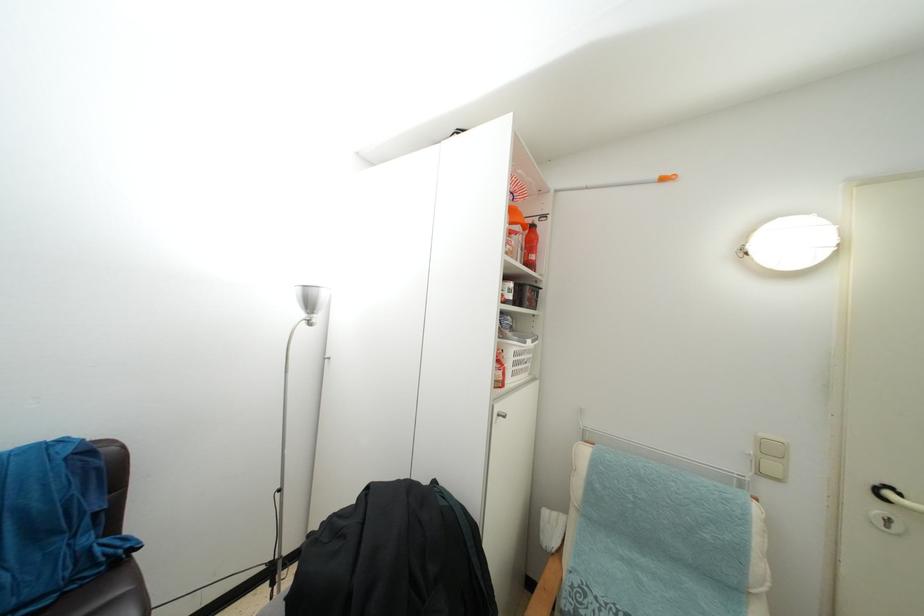
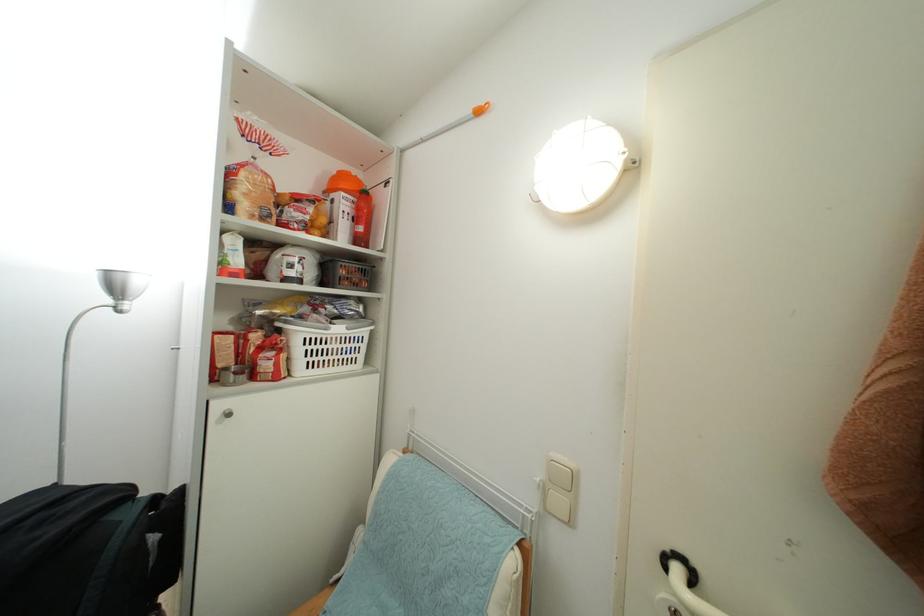
Locate, in the second image, the point that corresponds to the point at 537,262 in the first image.

(365, 235)